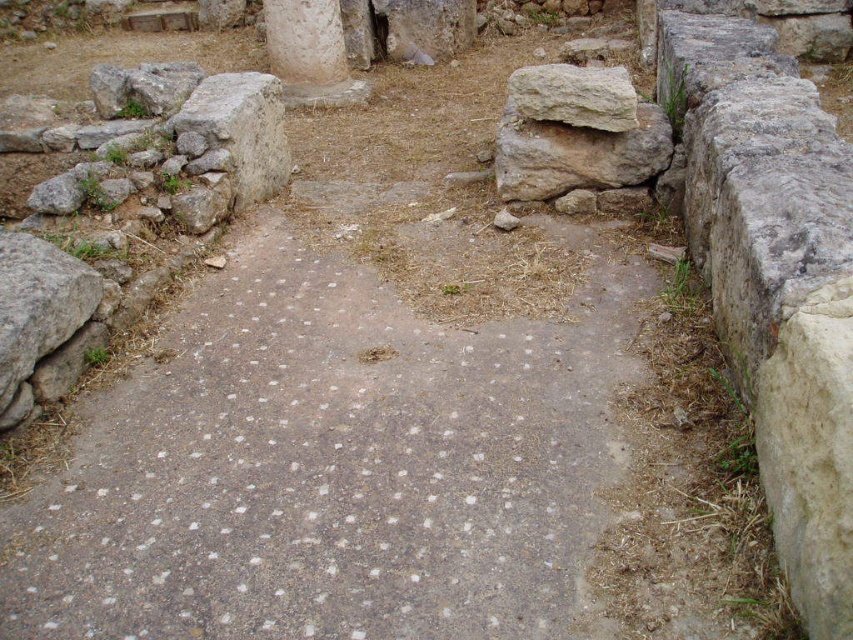
You are an archaeologist examining the site. You need to determine which object is higher in elevation between the gray stone path at center and the light gray stone boulder at upper right. Based on the scene, which one is taller?

The gray stone path at center is taller than the light gray stone boulder at upper right according to the description.